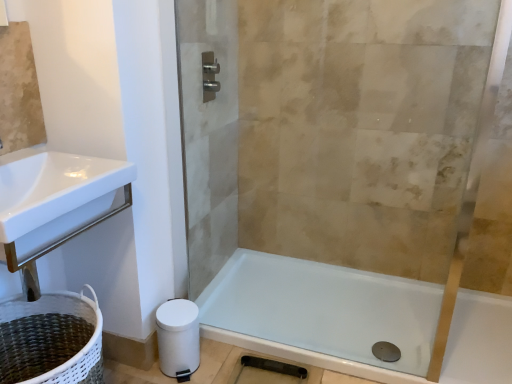
You are a GUI agent. You are given a task and a screenshot of the screen. Output one action in this format:
    pyautogui.click(x=<x>, y=<y>)
    Task: Click on the vacant point above white glossy bathtub at lower right (from a real-world perspective)
    Image resolution: width=512 pixels, height=384 pixels.
    Given the screenshot: What is the action you would take?
    pyautogui.click(x=322, y=332)